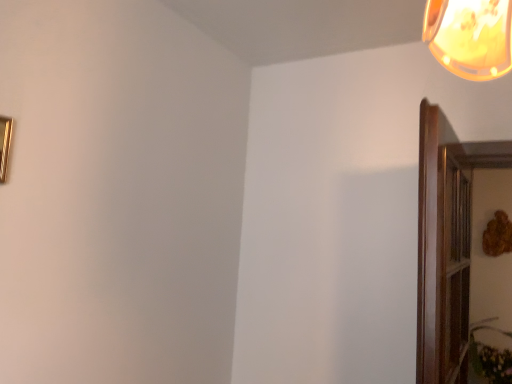
Question: From a real-world perspective, is gold metallic picture frame at upper left above or below green leafy plant at lower right?

Choices:
 (A) above
 (B) below

Answer: (A)

Question: From their relative heights in the image, would you say gold metallic picture frame at upper left is taller or shorter than green leafy plant at lower right?

Choices:
 (A) short
 (B) tall

Answer: (A)

Question: In the image, is gold metallic picture frame at upper left on the left side or the right side of green leafy plant at lower right?

Choices:
 (A) right
 (B) left

Answer: (B)

Question: Based on their sizes in the image, would you say green leafy plant at lower right is bigger or smaller than gold metallic picture frame at upper left?

Choices:
 (A) small
 (B) big

Answer: (B)

Question: In the image, is green leafy plant at lower right on the left side or the right side of gold metallic picture frame at upper left?

Choices:
 (A) right
 (B) left

Answer: (A)

Question: From a real-world perspective, relative to gold metallic picture frame at upper left, is green leafy plant at lower right vertically above or below?

Choices:
 (A) above
 (B) below

Answer: (B)

Question: Is green leafy plant at lower right in front of or behind gold metallic picture frame at upper left in the image?

Choices:
 (A) behind
 (B) front

Answer: (A)